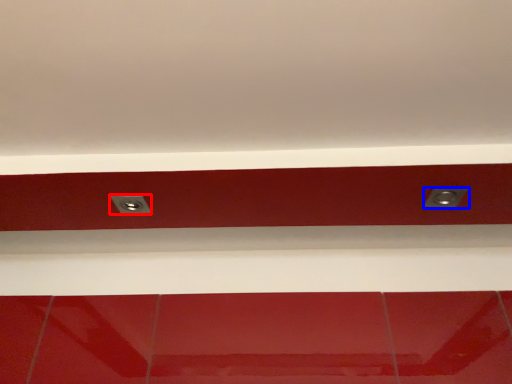
Question: Among these objects, which one is nearest to the camera, power plugs and sockets (highlighted by a red box) or power plugs and sockets (highlighted by a blue box)?

Choices:
 (A) power plugs and sockets
 (B) power plugs and sockets

Answer: (B)